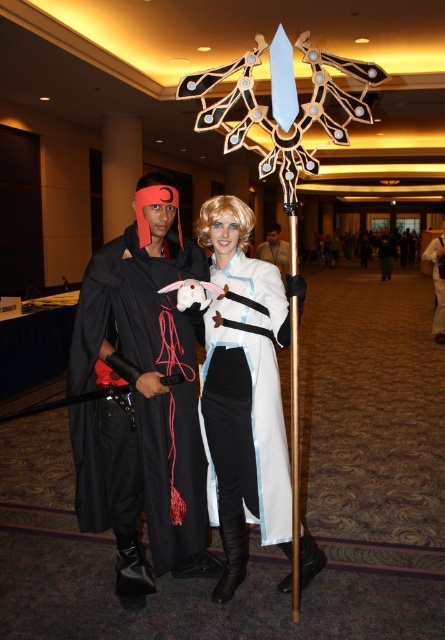
Measure the distance between matte black cape at left and camera.

matte black cape at left is 6.76 feet from camera.

Is matte black cape at left to the right of white matte scarf at center from the viewer's perspective?

In fact, matte black cape at left is to the left of white matte scarf at center.

Is point (177, 352) positioned before point (443, 241)?

Yes, it is in front of point (443, 241).

What are the coordinates of `matte black cape at left` in the screenshot? It's located at (141, 397).

How far apart are matte black cape at left and white matte/soft fabric dress at center?

matte black cape at left and white matte/soft fabric dress at center are 10.39 inches apart from each other.

Can you confirm if matte black cape at left is bigger than white matte/soft fabric dress at center?

No, matte black cape at left is not bigger than white matte/soft fabric dress at center.

Is point (117, 262) closer to camera compared to point (275, 356)?

Yes, it is in front of point (275, 356).

Where is `matte black cape at left`? This screenshot has height=640, width=445. matte black cape at left is located at coordinates (141, 397).

Locate an element on the screen. Image resolution: width=445 pixels, height=640 pixels. white matte scarf at center is located at coordinates (437, 282).

Who is more forward, [440,310] or [267,246]?

Point [267,246]

This screenshot has height=640, width=445. In order to click on white matte scarf at center in this screenshot , I will do `click(437, 282)`.